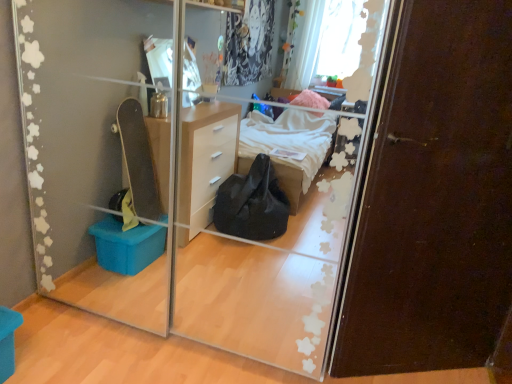
Describe the element at coordinates (434, 197) in the screenshot. This screenshot has height=384, width=512. I see `brown matte door at right` at that location.

At what (x,y) coordinates should I click in order to perform the action: click on brown matte door at right. Please return your answer as a coordinate pair (x, y). The image size is (512, 384). Looking at the image, I should click on (434, 197).

You are a GUI agent. You are given a task and a screenshot of the screen. Output one action in this format:
    pyautogui.click(x=<x>, y=<y>)
    Task: Click on the brown matte door at right
    The height and width of the screenshot is (384, 512).
    Given the screenshot: What is the action you would take?
    pyautogui.click(x=434, y=197)